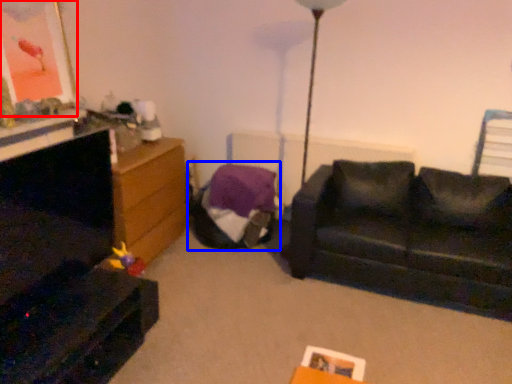
Question: Which of the following is the farthest to the observer, picture frame (highlighted by a red box) or bean bag chair (highlighted by a blue box)?

Choices:
 (A) picture frame
 (B) bean bag chair

Answer: (B)